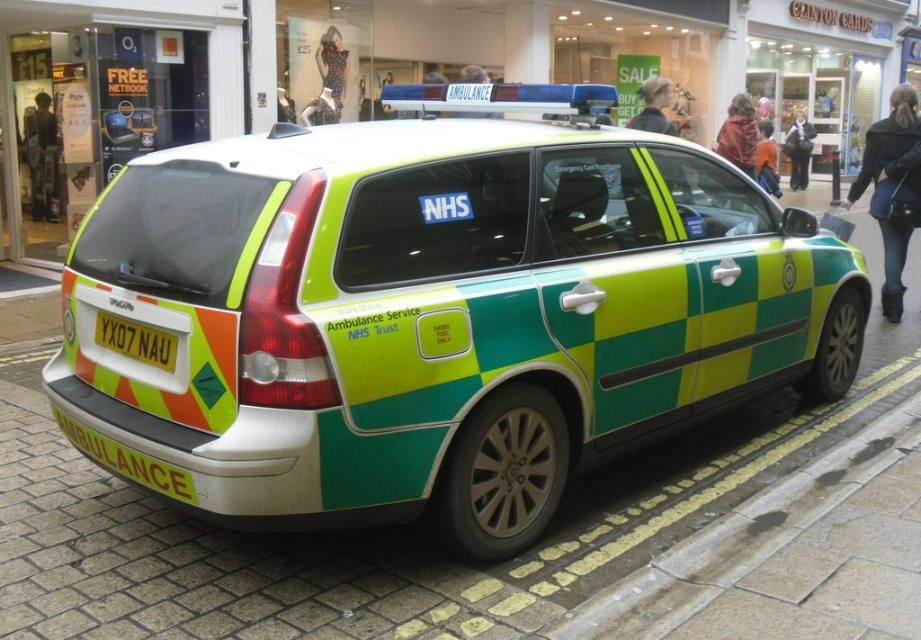
You are standing at the point marked by coordinates (435, 310) in the shopping area. Based on the scene description, what object are you most likely standing on?

The point marked by coordinates (435, 310) corresponds to the green checkered ambulance at center, so you are most likely standing on the green checkered ambulance at center.

You are a photographer trying to capture the entire ambulance and its license plate clearly in one shot. Given that the green checkered ambulance at center is larger than the yellow metallic license plate at rear, which object should you focus on first to ensure both are in frame?

Since the green checkered ambulance at center is larger than the yellow metallic license plate at rear, you should focus on the green checkered ambulance at center first to ensure it fits in the frame, then adjust to include the smaller yellow metallic license plate at rear.

You are a pedestrian standing at the point with coordinates point (379,182) and want to walk to the point with coordinates point (121,328). Given the layout of the shopping area and the parked ambulance, will you have to walk around the ambulance to reach your destination?

Since point (379,182) is in front of point (121,328), you will not have to walk around the ambulance to reach your destination.